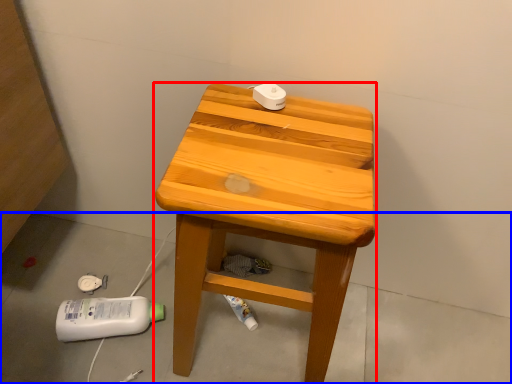
Question: Which point is closer to the camera, stool (highlighted by a red box) or concrete (highlighted by a blue box)?

Choices:
 (A) stool
 (B) concrete

Answer: (A)